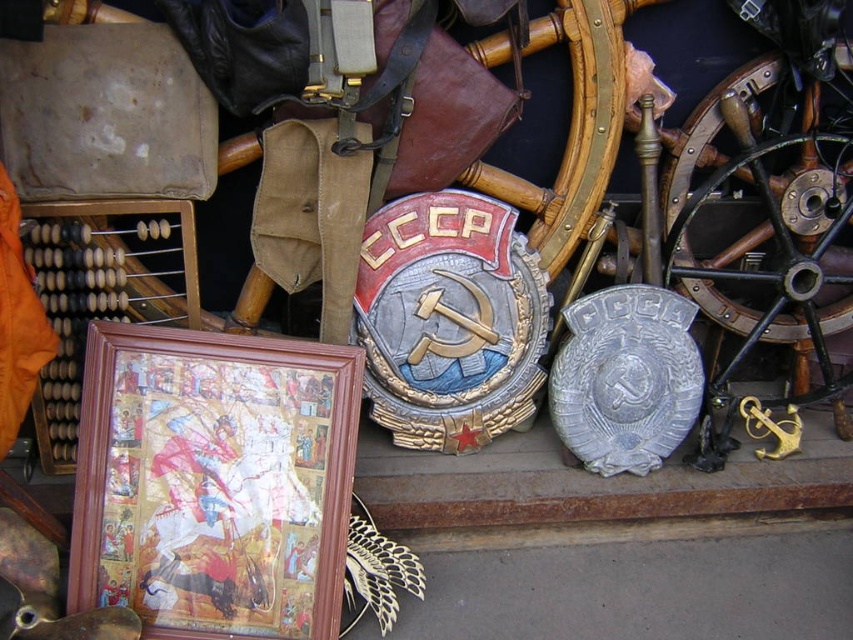
From the picture: You are setting up a display and need to place a small decorative item between the wooden frame at lower left and the polished brass wheel at right. Based on their widths, which object should you place closer to the center of the display to ensure balance?

The wooden frame at lower left might be wider than the polished brass wheel at right, so placing the wooden frame closer to the center would help balance the display by compensating for its potentially larger width.

You are setting up a display and need to know which object takes up more space. Based on the scene, which object is larger in size between the wooden frame at lower left and the polished brass wheel at right?

The polished brass wheel at right occupies more space than the wooden frame at lower left according to the description.

You are a collector examining the artifacts displayed in the scene. You notice the wooden frame at lower left and the polished brass wheel at right. Which artifact is positioned lower in the image?

The wooden frame at lower left is located below the polished brass wheel at right, so it is positioned lower in the image.